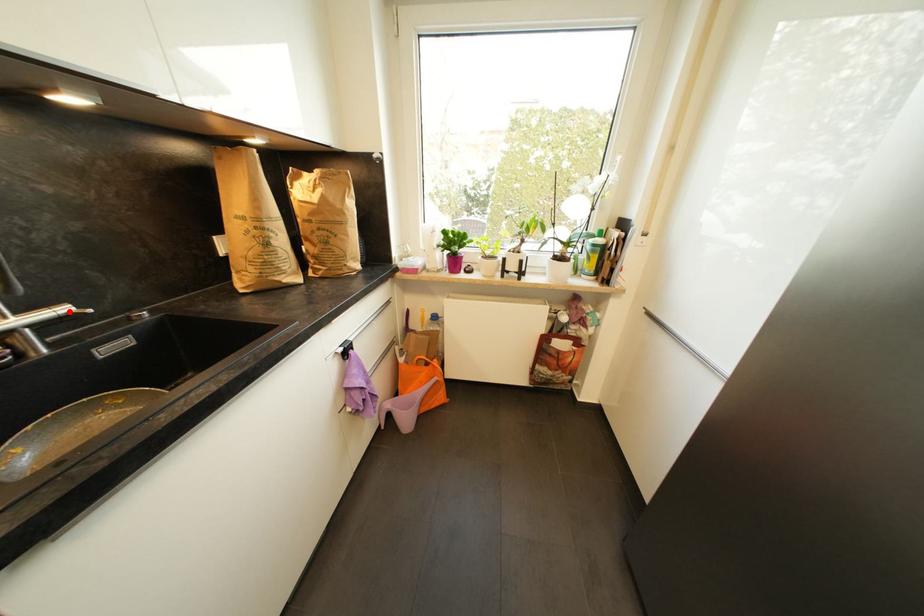
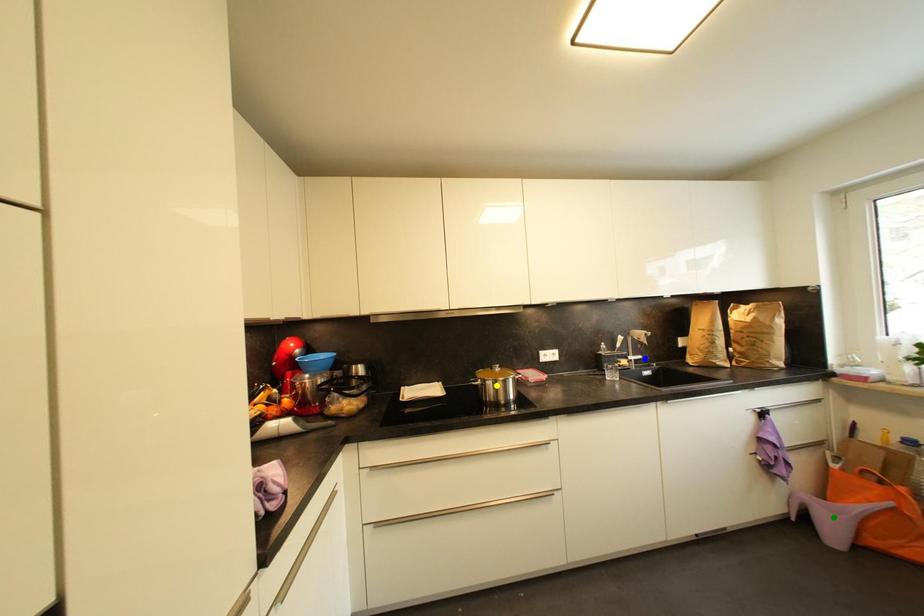
Question: I am providing you with two images of the same scene from different viewpoints. A red point is marked on the first image. You are given multiple points on the second image. Which point in image 2 represents the same 3d spot as the red point in image 1?

Choices:
 (A) blue point
 (B) yellow point
 (C) green point

Answer: (A)